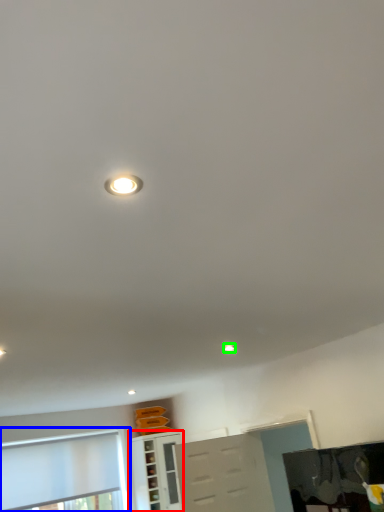
Question: Which object is positioned closest to cabinetry (highlighted by a red box)? Select from window (highlighted by a blue box) and droplight (highlighted by a green box).

Choices:
 (A) window
 (B) droplight

Answer: (A)